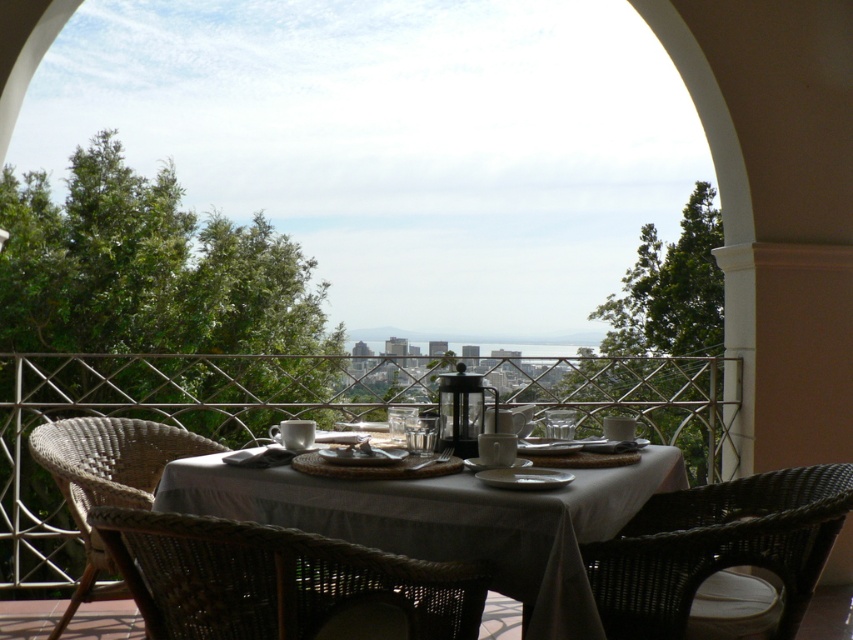
You are sitting at the table and want to reach the white ceramic plate at center. Which object, the woven dark brown chair at lower right or the plate itself, is closer to you?

The woven dark brown chair at lower right is in front of the white ceramic plate at center, so the chair is closer to you than the plate.

In the scene shown: You are standing at the edge of the balcony looking out towards the cityscape. You want to move from your current position to the woven dark brown chair at lower right without stepping on the white woven table at center. Is this possible based on their positions?

The white woven table at center is located above the woven dark brown chair at lower right, so you can safely move to the chair without stepping on the table since the table is positioned higher up.

You are standing at the entrance of the balcony and want to sit down at the table. Which object at point (281, 582) should you approach first?

The woven rattan chair at lower center is located at point (281, 582), so you should approach the woven rattan chair at lower center first to sit down.